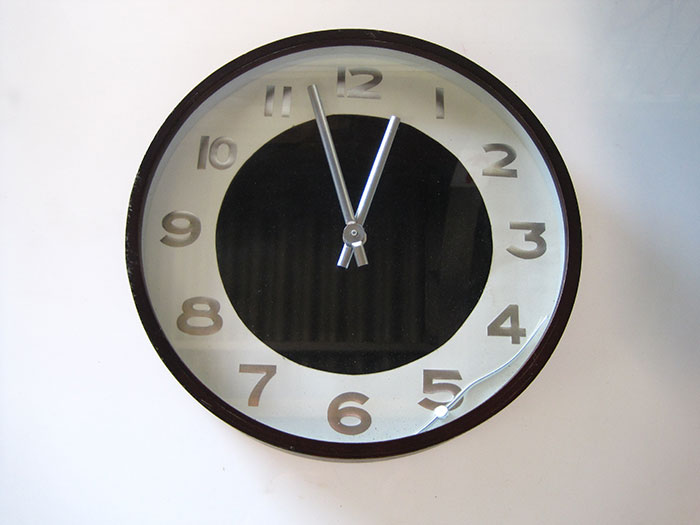
This screenshot has width=700, height=525. In order to click on white wall in this screenshot , I will do `click(50, 100)`.